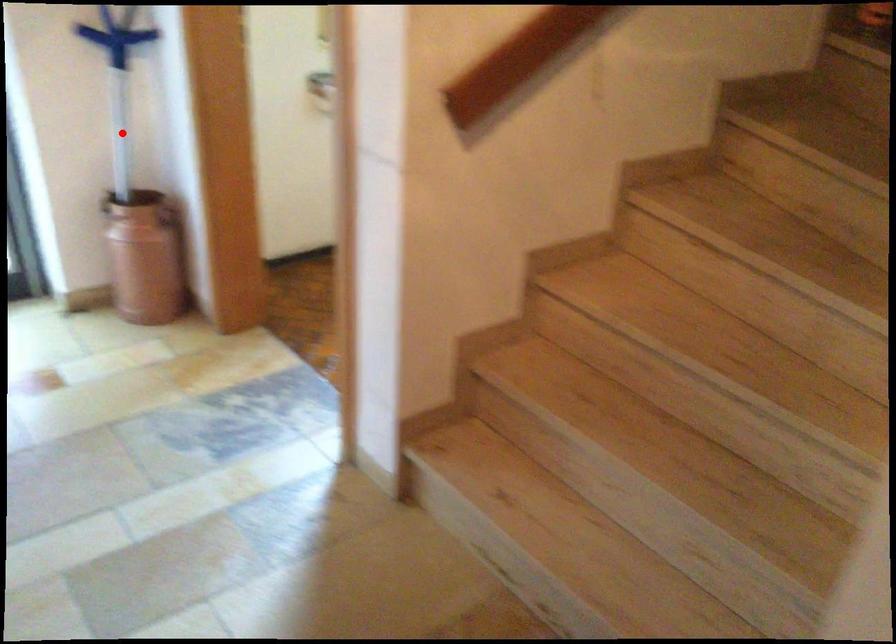
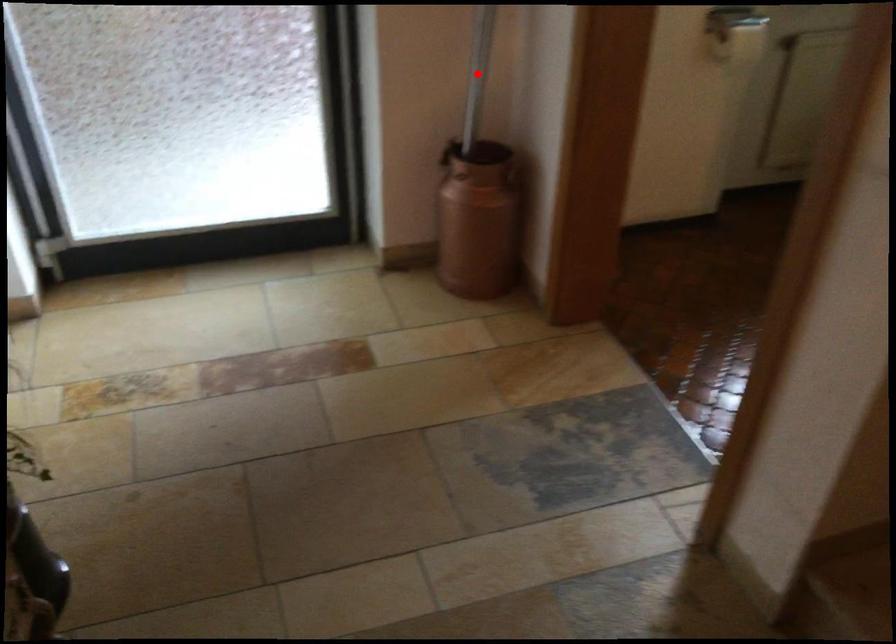
I am providing you with two images of the same scene from different viewpoints. A red point is marked on the first image and another point is marked on the second image. Does the point marked in image1 correspond to the same location as the one in image2?

Yes